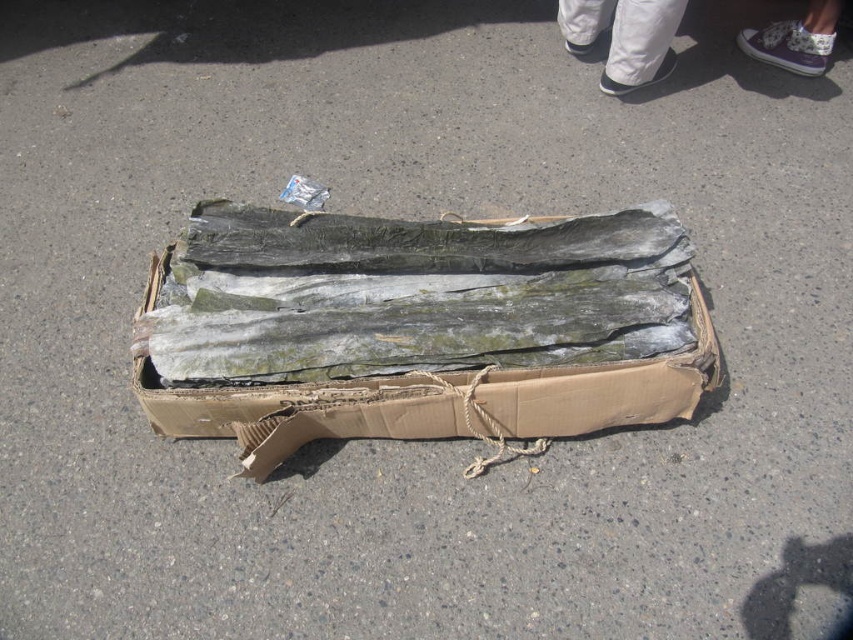
Question: Is brown cardboard box at center thinner than white fabric pants at upper center?

Choices:
 (A) no
 (B) yes

Answer: (A)

Question: Estimate the real-world distances between objects in this image. Which object is closer to the brown cardboard box at center?

Choices:
 (A) greenish-gray wood at center
 (B) white fabric pants at upper center

Answer: (A)

Question: Which object is the closest to the greenish-gray wood at center?

Choices:
 (A) white fabric pants at upper center
 (B) brown cardboard box at center

Answer: (B)

Question: Is brown cardboard box at center above greenish-gray wood at center?

Choices:
 (A) yes
 (B) no

Answer: (B)

Question: Is brown cardboard box at center bigger than greenish-gray wood at center?

Choices:
 (A) no
 (B) yes

Answer: (B)

Question: Which is farther from the brown cardboard box at center?

Choices:
 (A) greenish-gray wood at center
 (B) white fabric pants at upper center

Answer: (B)